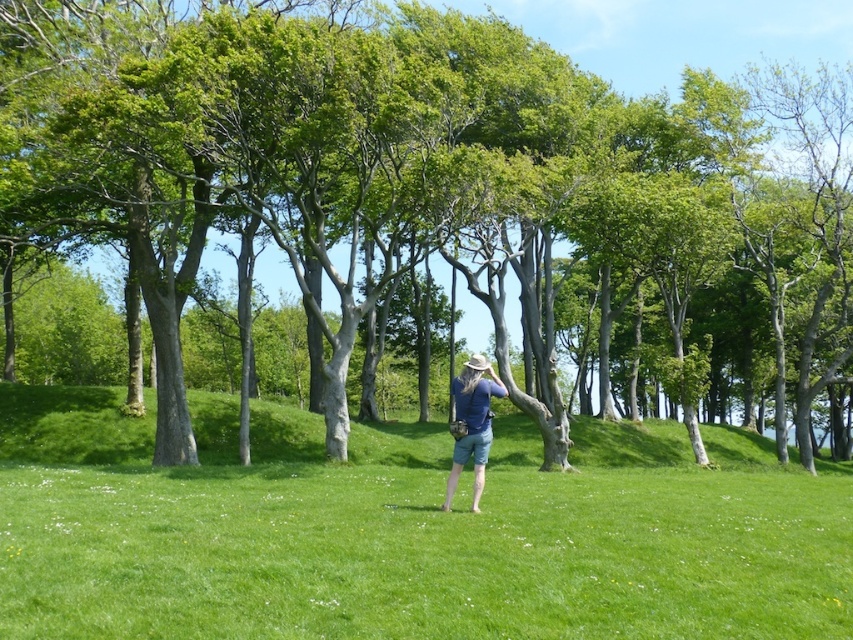
You are a photographer trying to capture the person in the scene. Since the green grass at center and the blue denim shorts at center are both in the frame, which one appears bigger in the photo?

The green grass at center appears bigger in the photo because it is larger in size than the blue denim shorts at center according to the description.

You are a photographer standing at the edge of a forest. You want to take a photo of the green smooth tree at center. Your camera has a maximum zoom range of 20 meters. Can you capture the tree in full without moving closer?

The distance between you and the green smooth tree at center is 18.94 meters, which is within the camera maximum zoom range of 20 meters. So yes, you can capture the tree in full without moving closer.